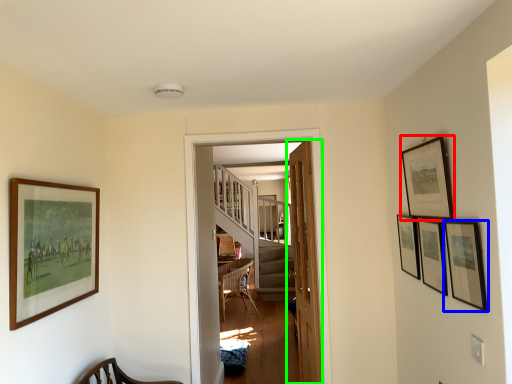
Question: Based on their relative distances, which object is farther from picture frame (highlighted by a red box)? Choose from picture frame (highlighted by a blue box) and door (highlighted by a green box).

Choices:
 (A) picture frame
 (B) door

Answer: (B)